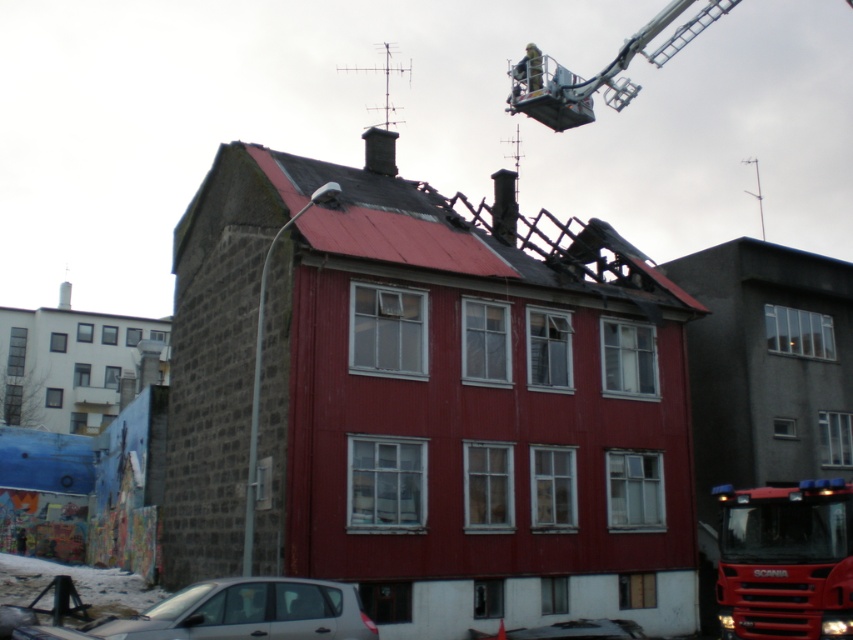
How much distance is there between red glossy fire truck at lower right and smooth gray chimney at center?

red glossy fire truck at lower right is 25.86 meters from smooth gray chimney at center.

Can you confirm if red glossy fire truck at lower right is positioned below smooth gray chimney at center?

Correct, red glossy fire truck at lower right is located below smooth gray chimney at center.

Who is more forward, (828,536) or (383,172)?

Point (828,536) is in front.

This screenshot has height=640, width=853. Find the location of `red glossy fire truck at lower right`. red glossy fire truck at lower right is located at coordinates (786, 561).

Can you confirm if smooth stone chimney at upper center is bigger than smooth gray chimney at center?

No, smooth stone chimney at upper center is not bigger than smooth gray chimney at center.

Between smooth stone chimney at upper center and smooth gray chimney at center, which one appears on the right side from the viewer's perspective?

Positioned to the right is smooth stone chimney at upper center.

Between point (506, 198) and point (392, 131), which one is positioned behind?

The point (392, 131) is more distant.

Identify the location of smooth stone chimney at upper center. (503, 205).

Is the position of silver metallic car at lower left less distant than that of smooth stone chimney at upper center?

Yes, silver metallic car at lower left is closer to the viewer.

Between silver metallic car at lower left and smooth stone chimney at upper center, which one has more height?

smooth stone chimney at upper center

The width and height of the screenshot is (853, 640). Find the location of `silver metallic car at lower left`. silver metallic car at lower left is located at coordinates (x=235, y=612).